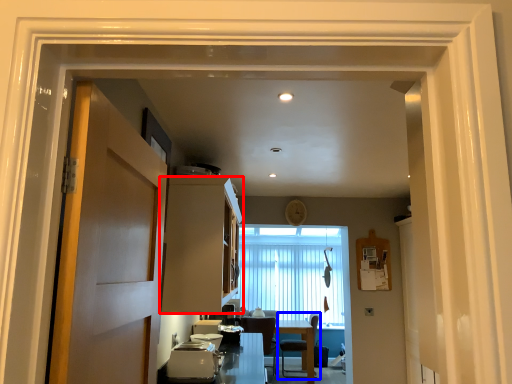
Question: Among these objects, which one is farthest to the camera, cabinetry (highlighted by a red box) or chair (highlighted by a blue box)?

Choices:
 (A) cabinetry
 (B) chair

Answer: (B)